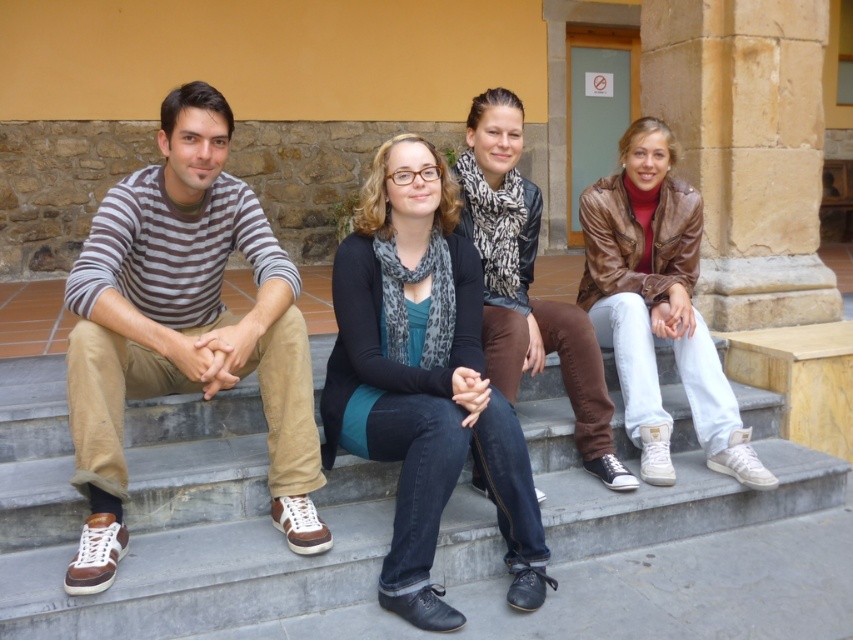
Question: Can you confirm if gray concrete stairs at center is smaller than leopard print scarf at center?

Choices:
 (A) yes
 (B) no

Answer: (B)

Question: Which object appears closest to the camera in this image?

Choices:
 (A) brown stone pillar at right
 (B) matte black scarf at center
 (C) brown suede shoes at left

Answer: (C)

Question: Is brown suede shoes at left bigger than brown stone pillar at right?

Choices:
 (A) yes
 (B) no

Answer: (A)

Question: Among these objects, which one is nearest to the camera?

Choices:
 (A) gray concrete stairs at center
 (B) brown suede shoes at left
 (C) matte black scarf at center

Answer: (A)

Question: Which object is positioned closest to the brown suede shoes at left?

Choices:
 (A) brown stone pillar at right
 (B) brown leather jacket at lower right
 (C) leopard print scarf at center

Answer: (C)

Question: Is brown stone pillar at right positioned before brown leather jacket at lower right?

Choices:
 (A) yes
 (B) no

Answer: (B)